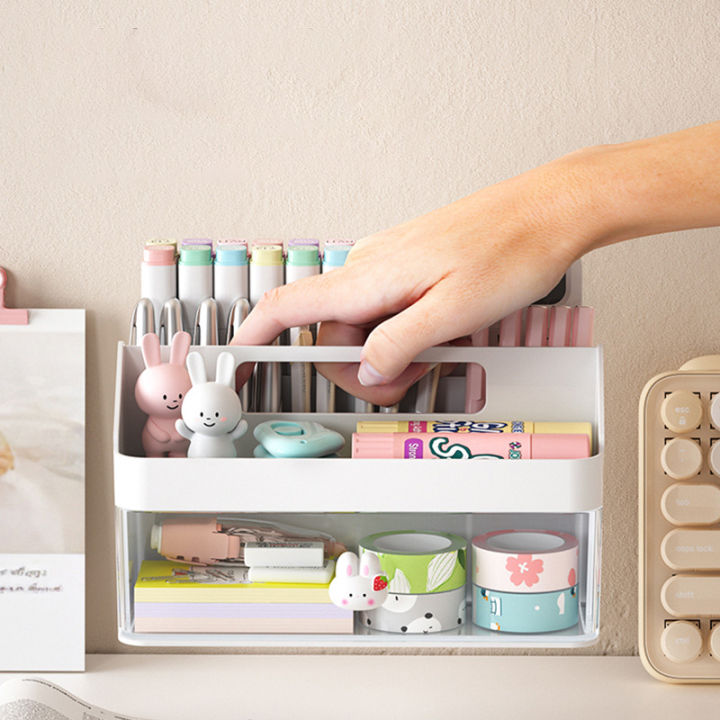
Locate an element on the screen. The image size is (720, 720). visible and partly visible pink cylinders on top shelf is located at coordinates (482, 341), (512, 333), (535, 333), (558, 332), (582, 335).